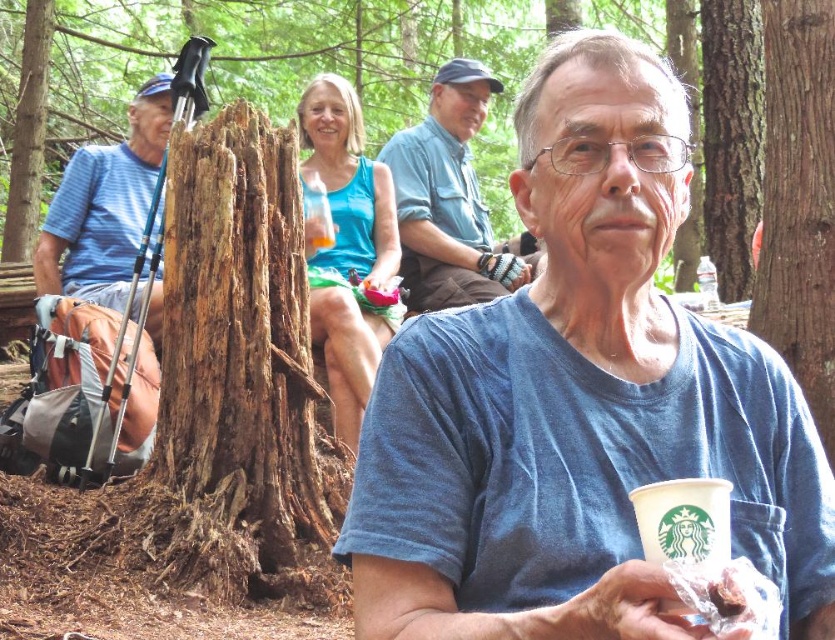
Question: Can you confirm if blue fabric tank top at upper center is positioned to the right of blue striped shirt at left?

Choices:
 (A) yes
 (B) no

Answer: (A)

Question: Estimate the real-world distances between objects in this image. Which object is closer to the smooth bark tree at right?

Choices:
 (A) blue fabric tank top at upper center
 (B) chocolate cake at center
 (C) blue cotton shirt at center
 (D) blue striped shirt at left

Answer: (C)

Question: Which point is closer to the camera?

Choices:
 (A) (636, 563)
 (B) (304, 193)

Answer: (A)

Question: Can you confirm if smooth bark tree at right is bigger than blue striped shirt at left?

Choices:
 (A) yes
 (B) no

Answer: (B)

Question: Among these points, which one is nearest to the camera?

Choices:
 (A) click(x=358, y=125)
 (B) click(x=304, y=214)

Answer: (B)

Question: In this image, where is blue striped shirt at left located relative to chocolate cake at center?

Choices:
 (A) above
 (B) below

Answer: (A)